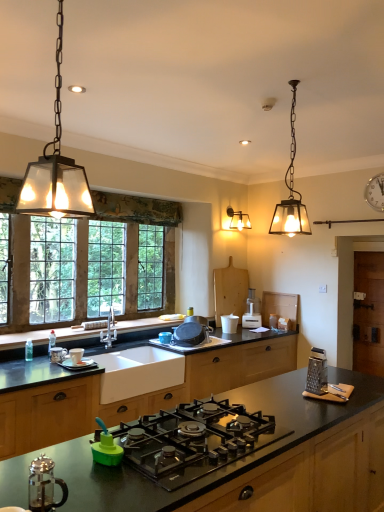
Identify the location of free spot to the right of white ceramic cup at lower left, the 1th appliance from the left. This screenshot has width=384, height=512. (101, 365).